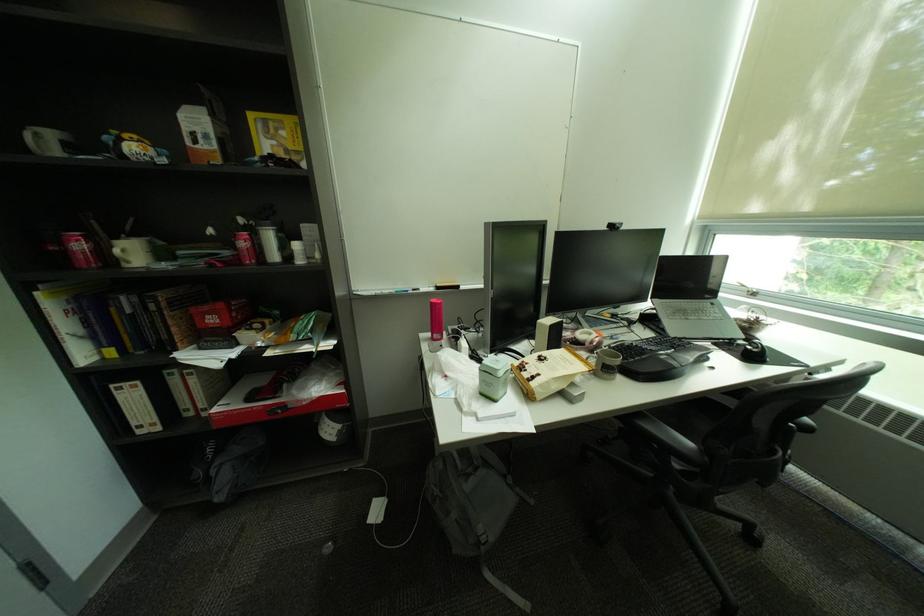
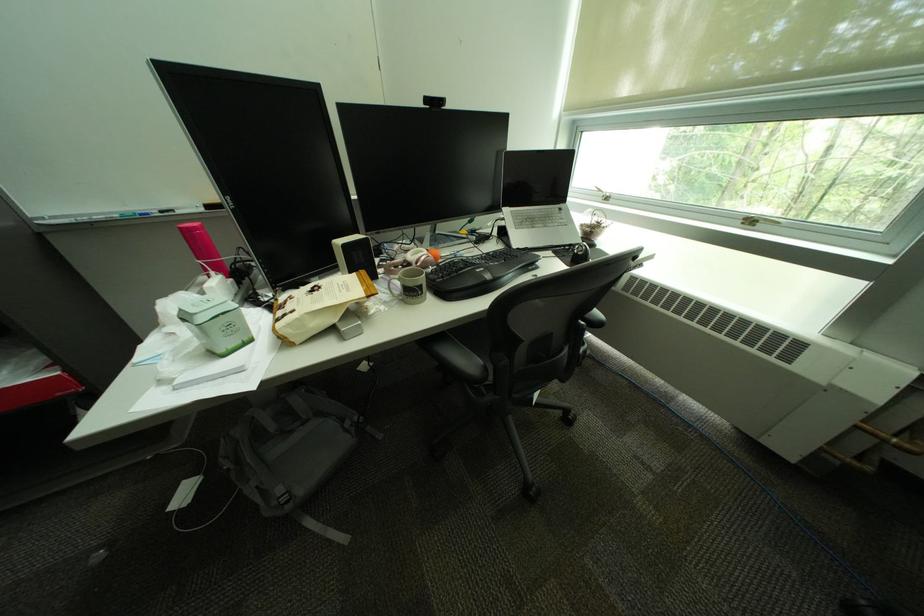
Question: Which direction would the cameraman need to move to produce the second image? Reply with the corresponding letter.

Choices:
 (A) Left
 (B) Right
 (C) Forward
 (D) Backward

Answer: (B)